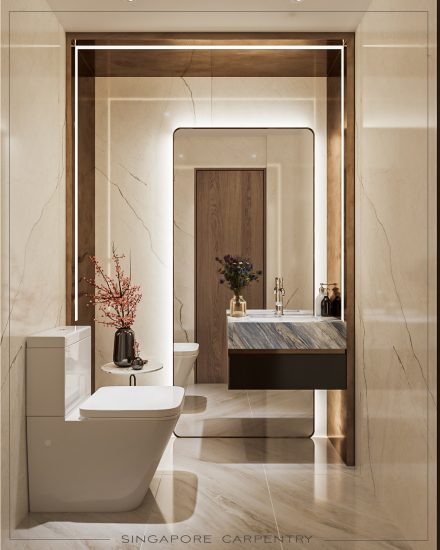
Where is `marble  floor`? This screenshot has height=550, width=440. marble  floor is located at coordinates (239, 513).